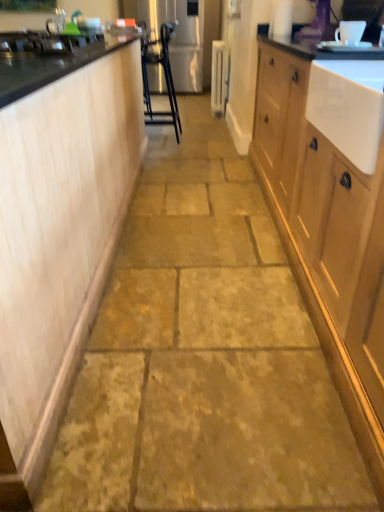
Measure the distance between silver metallic faucet at upper left and camera.

A distance of 2.33 meters exists between silver metallic faucet at upper left and camera.

I want to click on white painted radiator at center, the first appliance in the left-to-right sequence, so click(219, 77).

Locate an element on the screen. white ceramic mug at upper center, the 1th appliance when ordered from right to left is located at coordinates (350, 32).

Measure the distance between natural stone floor at center and camera.

natural stone floor at center is 3.46 feet away from camera.

Identify the location of metallic silver bar stool at center. (165, 79).

Considering the sizes of objects silver metallic faucet at upper left and wooden cabinet at right, which is the first cabinetry from right to left, in the image provided, who is taller, silver metallic faucet at upper left or wooden cabinet at right, which is the first cabinetry from right to left,?

wooden cabinet at right, which is the first cabinetry from right to left.

From the image's perspective, is silver metallic faucet at upper left on wooden cabinet at right, which is counted as the 2th cabinetry, starting from the left?

Yes, from the image's perspective, silver metallic faucet at upper left is on top of wooden cabinet at right, which is counted as the 2th cabinetry, starting from the left.

Which is in front, point (58, 29) or point (290, 59)?

The point (290, 59) is in front.

From a real-world perspective, starting from the silver metallic faucet at upper left, which cabinetry is the 2nd one below it? Please provide its 2D coordinates.

[(327, 238)]

Does wooden cabinet at right, which is counted as the 2th cabinetry, starting from the left, come in front of natural stone floor at center?

Yes, wooden cabinet at right, which is counted as the 2th cabinetry, starting from the left, is in front of natural stone floor at center.

In the scene shown: From the image's perspective, would you say wooden cabinet at right, which is counted as the 2th cabinetry, starting from the left, is positioned over natural stone floor at center?

No, from the image's perspective, wooden cabinet at right, which is counted as the 2th cabinetry, starting from the left, is not on top of natural stone floor at center.

Considering the relative sizes of wooden cabinet at right, which is the first cabinetry from right to left, and natural stone floor at center in the image provided, is wooden cabinet at right, which is the first cabinetry from right to left, taller than natural stone floor at center?

Correct, wooden cabinet at right, which is the first cabinetry from right to left, is much taller as natural stone floor at center.

Is wooden cabinet at right, which is counted as the 2th cabinetry, starting from the left, not close to natural stone floor at center?

Actually, wooden cabinet at right, which is counted as the 2th cabinetry, starting from the left, and natural stone floor at center are a little close together.

From the image's perspective, does wooden cabinet at right, which is counted as the 2th cabinetry, starting from the left, appear lower than metallic silver bar stool at center?

Indeed, from the image's perspective, wooden cabinet at right, which is counted as the 2th cabinetry, starting from the left, is shown beneath metallic silver bar stool at center.

Is wooden cabinet at right, which is counted as the 2th cabinetry, starting from the left, next to metallic silver bar stool at center and touching it?

No.

From a real-world perspective, is wooden cabinet at right, which is counted as the 2th cabinetry, starting from the left, below metallic silver bar stool at center?

Yes, from a real-world perspective, wooden cabinet at right, which is counted as the 2th cabinetry, starting from the left, is below metallic silver bar stool at center.

Between wooden cabinet at right, which is the first cabinetry from right to left, and metallic silver bar stool at center, which one has less height?

wooden cabinet at right, which is the first cabinetry from right to left, is shorter.

Is the depth of white painted radiator at center, which is the first appliance from back to front, greater than that of natural stone floor at center?

That is True.

Based on the photo, from a real-world perspective, which is physically below, white painted radiator at center, the 2th appliance positioned from the front, or natural stone floor at center?

From a 3D spatial view, natural stone floor at center is below.

Considering the sizes of white painted radiator at center, the 2th appliance positioned from the bottom, and natural stone floor at center in the image, is white painted radiator at center, the 2th appliance positioned from the bottom, taller or shorter than natural stone floor at center?

white painted radiator at center, the 2th appliance positioned from the bottom, is taller than natural stone floor at center.

Is white painted radiator at center, the 2th appliance positioned from the front, in contact with natural stone floor at center?

No.

From a real-world perspective, is wooden cabinet at right, which is counted as the 2th cabinetry, starting from the left, on silver metallic faucet at upper left?

No.

Is wooden cabinet at right, which is counted as the 2th cabinetry, starting from the left, wider or thinner than silver metallic faucet at upper left?

In the image, wooden cabinet at right, which is counted as the 2th cabinetry, starting from the left, appears to be wider than silver metallic faucet at upper left.

Can you confirm if wooden cabinet at right, which is counted as the 2th cabinetry, starting from the left, is smaller than silver metallic faucet at upper left?

Incorrect, wooden cabinet at right, which is counted as the 2th cabinetry, starting from the left, is not smaller in size than silver metallic faucet at upper left.

Would you consider light wood cabinetry at left, the first cabinetry when ordered from left to right, to be distant from white ceramic mug at upper center, arranged as the second appliance when viewed from the top?

light wood cabinetry at left, the first cabinetry when ordered from left to right, is positioned a significant distance from white ceramic mug at upper center, arranged as the second appliance when viewed from the top.

Is light wood cabinetry at left, the first cabinetry when ordered from left to right, to the left or to the right of white ceramic mug at upper center, arranged as the second appliance when viewed from the top, in the image?

In the image, light wood cabinetry at left, the first cabinetry when ordered from left to right, appears on the left side of white ceramic mug at upper center, arranged as the second appliance when viewed from the top.

Between point (33, 494) and point (338, 35), which one is positioned in front?

Positioned in front is point (33, 494).

Which object is closer to the camera, light wood cabinetry at left, the 2th cabinetry when ordered from right to left, or white ceramic mug at upper center, placed as the 2th appliance when sorted from back to front?

light wood cabinetry at left, the 2th cabinetry when ordered from right to left, is closer to the camera.

Considering the sizes of objects natural stone floor at center and white painted radiator at center, the 2th appliance positioned from the bottom, in the image provided, who is wider, natural stone floor at center or white painted radiator at center, the 2th appliance positioned from the bottom,?

natural stone floor at center.

Would you say natural stone floor at center is outside white painted radiator at center, the 2th appliance positioned from the bottom?

natural stone floor at center is positioned outside white painted radiator at center, the 2th appliance positioned from the bottom.

Does natural stone floor at center lie behind white painted radiator at center, which is the first appliance from back to front?

No, it is in front of white painted radiator at center, which is the first appliance from back to front.

Which appliance is the 2nd one when counting from the back of the natural stone floor at center? Please provide its 2D coordinates.

[(219, 77)]

The width and height of the screenshot is (384, 512). In order to click on faucet located above the wooden cabinet at right, which is counted as the 2th cabinetry, starting from the left (from a real-world perspective) in this screenshot , I will do pos(56,22).

Identify the location of cabinetry lying on the right of natural stone floor at center. (327, 238).

From the image, which object appears to be farther from wooden cabinet at right, which is the first cabinetry from right to left, white painted radiator at center, the first appliance in the left-to-right sequence, or silver metallic faucet at upper left?

white painted radiator at center, the first appliance in the left-to-right sequence.

Considering their positions, is white painted radiator at center, which is the first appliance from back to front, positioned further to natural stone floor at center than white ceramic mug at upper center, the 1th appliance when ordered from right to left?

white painted radiator at center, which is the first appliance from back to front, is positioned further to the anchor natural stone floor at center.

Based on the photo, considering their positions, is white ceramic mug at upper center, the second appliance in the left-to-right sequence, positioned closer to light wood cabinetry at left, the 2th cabinetry when ordered from right to left, than silver metallic faucet at upper left?

silver metallic faucet at upper left.

From the image, which object appears to be farther from wooden cabinet at right, which is counted as the 2th cabinetry, starting from the left, white ceramic mug at upper center, arranged as the second appliance when viewed from the top, or natural stone floor at center?

white ceramic mug at upper center, arranged as the second appliance when viewed from the top, is further to wooden cabinet at right, which is counted as the 2th cabinetry, starting from the left.

Which object lies nearer to the anchor point silver metallic faucet at upper left, wooden cabinet at right, which is the first cabinetry from right to left, or light wood cabinetry at left, the 2th cabinetry when ordered from right to left?

The object closer to silver metallic faucet at upper left is light wood cabinetry at left, the 2th cabinetry when ordered from right to left.

Estimate the real-world distances between objects in this image. Which object is closer to natural stone floor at center, light wood cabinetry at left, the 2th cabinetry when ordered from right to left, or white ceramic mug at upper center, arranged as the second appliance when viewed from the top?

Result: light wood cabinetry at left, the 2th cabinetry when ordered from right to left, is closer to natural stone floor at center.

Looking at the image, which one is located further to metallic silver bar stool at center, white ceramic mug at upper center, arranged as the second appliance when viewed from the top, or wooden cabinet at right, which is counted as the 2th cabinetry, starting from the left?

wooden cabinet at right, which is counted as the 2th cabinetry, starting from the left, is further to metallic silver bar stool at center.

Estimate the real-world distances between objects in this image. Which object is further from silver metallic faucet at upper left, metallic silver bar stool at center or natural stone floor at center?

Based on the image, natural stone floor at center appears to be further to silver metallic faucet at upper left.

I want to click on path between light wood cabinetry at left, the first cabinetry when ordered from left to right, and metallic silver bar stool at center in the front-back direction, so click(203, 357).

You are a GUI agent. You are given a task and a screenshot of the screen. Output one action in this format:
    pyautogui.click(x=<x>, y=<y>)
    Task: Click on the cabinetry between wooden cabinet at right, which is counted as the 2th cabinetry, starting from the left, and white painted radiator at center, arranged as the 2th appliance when viewed from the right, along the z-axis
    This screenshot has height=512, width=384.
    Given the screenshot: What is the action you would take?
    pyautogui.click(x=57, y=231)

You are a GUI agent. You are given a task and a screenshot of the screen. Output one action in this format:
    pyautogui.click(x=<x>, y=<y>)
    Task: Click on the furniture between wooden cabinet at right, which is the first cabinetry from right to left, and white painted radiator at center, which appears as the 1th appliance when viewed from the top, along the z-axis
    This screenshot has height=512, width=384.
    Given the screenshot: What is the action you would take?
    pyautogui.click(x=165, y=79)

Find the location of a particular element. The width and height of the screenshot is (384, 512). appliance between light wood cabinetry at left, the first cabinetry when ordered from left to right, and white painted radiator at center, which appears as the 1th appliance when viewed from the top, along the z-axis is located at coordinates (350, 32).